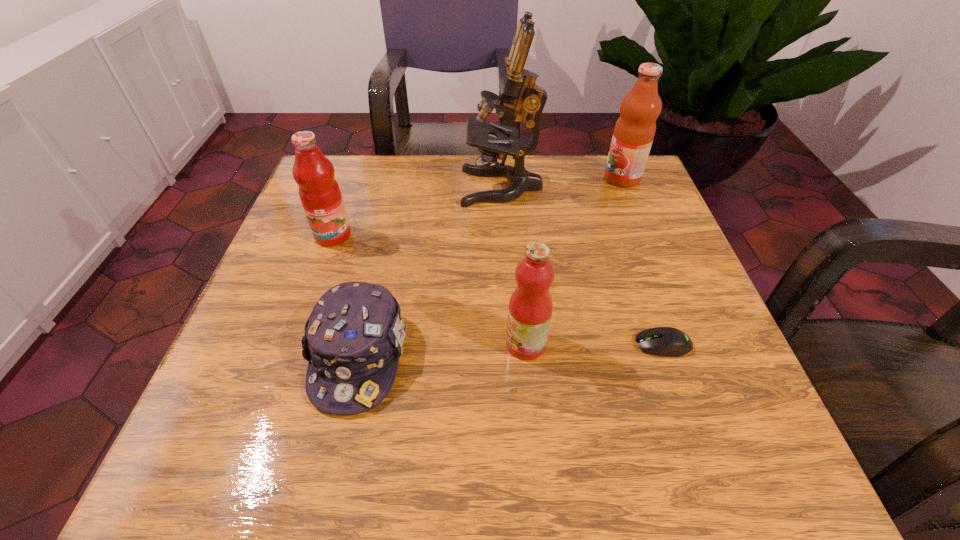
The height and width of the screenshot is (540, 960). What are the coordinates of `vacant area situated 0.360m on the wheel side of the computer mouse` in the screenshot? It's located at (423, 345).

In order to click on microscope that is positioned at the far edge in this screenshot , I will do click(518, 90).

In order to click on fruit juice situated at the far edge in this screenshot , I will do `click(634, 131)`.

Where is `fruit juice situated at the left edge`? fruit juice situated at the left edge is located at coordinates (319, 192).

The width and height of the screenshot is (960, 540). I want to click on headwear positioned at the left edge, so click(x=353, y=339).

Where is `fruit juice that is at the right edge`? fruit juice that is at the right edge is located at coordinates (634, 131).

At what (x,y) coordinates should I click in order to perform the action: click on computer mouse that is at the right edge. Please return your answer as a coordinate pair (x, y). The image size is (960, 540). Looking at the image, I should click on (660, 341).

Locate an element on the screen. object present at the far right corner is located at coordinates (634, 131).

You are a GUI agent. You are given a task and a screenshot of the screen. Output one action in this format:
    pyautogui.click(x=<x>, y=<y>)
    Task: Click on the vacant space at the far edge of the desktop
    
    Given the screenshot: What is the action you would take?
    pyautogui.click(x=536, y=191)

You are a GUI agent. You are given a task and a screenshot of the screen. Output one action in this format:
    pyautogui.click(x=<x>, y=<y>)
    Task: Click on the free point at the near edge
    
    Given the screenshot: What is the action you would take?
    pyautogui.click(x=599, y=452)